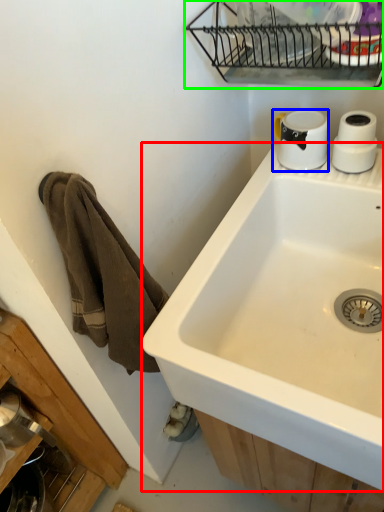
Question: Considering the real-world distances, which object is closest to sink (highlighted by a red box)? coffee cup (highlighted by a blue box) or appliance (highlighted by a green box).

Choices:
 (A) coffee cup
 (B) appliance

Answer: (A)